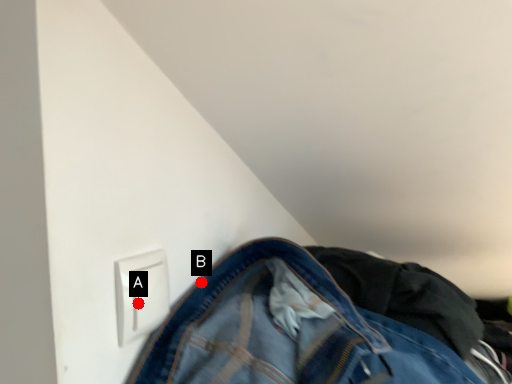
Question: Two points are circled on the image, labeled by A and B beside each circle. Among these points, which one is nearest to the camera?

Choices:
 (A) A is closer
 (B) B is closer

Answer: (A)